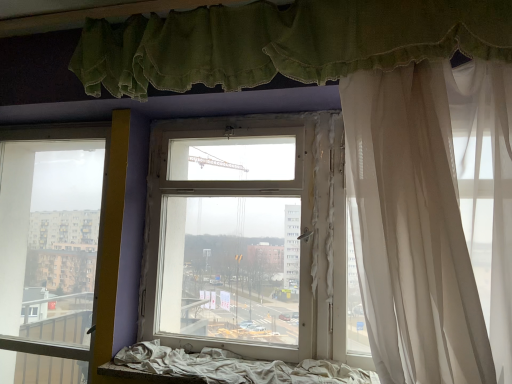
Question: Does green fabric curtain at upper center, the 2th curtain ordered from the bottom, have a greater height compared to transparent glass window at left, placed as the first window when sorted from left to right?

Choices:
 (A) no
 (B) yes

Answer: (A)

Question: Considering the relative sizes of green fabric curtain at upper center, the 2th curtain ordered from the bottom, and transparent glass window at left, arranged as the 2th window when viewed from the right, in the image provided, is green fabric curtain at upper center, the 2th curtain ordered from the bottom, wider than transparent glass window at left, arranged as the 2th window when viewed from the right,?

Choices:
 (A) no
 (B) yes

Answer: (B)

Question: Does green fabric curtain at upper center, positioned as the 1th curtain in top-to-bottom order, lie behind transparent glass window at left, placed as the first window when sorted from left to right?

Choices:
 (A) yes
 (B) no

Answer: (B)

Question: Is green fabric curtain at upper center, positioned as the 1th curtain in top-to-bottom order, touching transparent glass window at left, arranged as the 2th window when viewed from the right?

Choices:
 (A) no
 (B) yes

Answer: (A)

Question: Is green fabric curtain at upper center, positioned as the 1th curtain in top-to-bottom order, looking in the opposite direction of transparent glass window at left, arranged as the 2th window when viewed from the right?

Choices:
 (A) no
 (B) yes

Answer: (A)

Question: Is white fabric bed frame at lower center taller or shorter than white sheer curtain at right, the second curtain from the top?

Choices:
 (A) short
 (B) tall

Answer: (A)

Question: Is white fabric bed frame at lower center spatially inside white sheer curtain at right, positioned as the 1th curtain in bottom-to-top order, or outside of it?

Choices:
 (A) inside
 (B) outside

Answer: (B)

Question: Is white fabric bed frame at lower center in front of or behind white sheer curtain at right, the second curtain from the top, in the image?

Choices:
 (A) behind
 (B) front

Answer: (A)

Question: Does point (350, 370) appear closer or farther from the camera than point (472, 314)?

Choices:
 (A) closer
 (B) farther

Answer: (B)

Question: In the image, is white fabric bed frame at lower center on the left side or the right side of green fabric curtain at upper center, positioned as the 1th curtain in top-to-bottom order?

Choices:
 (A) right
 (B) left

Answer: (B)

Question: In terms of width, does white fabric bed frame at lower center look wider or thinner when compared to green fabric curtain at upper center, positioned as the 1th curtain in top-to-bottom order?

Choices:
 (A) wide
 (B) thin

Answer: (A)

Question: Is white fabric bed frame at lower center in front of or behind green fabric curtain at upper center, the 2th curtain ordered from the bottom, in the image?

Choices:
 (A) behind
 (B) front

Answer: (A)

Question: From a real-world perspective, is white fabric bed frame at lower center above or below green fabric curtain at upper center, positioned as the 1th curtain in top-to-bottom order?

Choices:
 (A) below
 (B) above

Answer: (A)

Question: Is white fabric bed frame at lower center bigger or smaller than transparent glass window at left, placed as the first window when sorted from left to right?

Choices:
 (A) small
 (B) big

Answer: (A)

Question: Considering the positions of point (218, 364) and point (78, 205), is point (218, 364) closer or farther from the camera than point (78, 205)?

Choices:
 (A) farther
 (B) closer

Answer: (B)